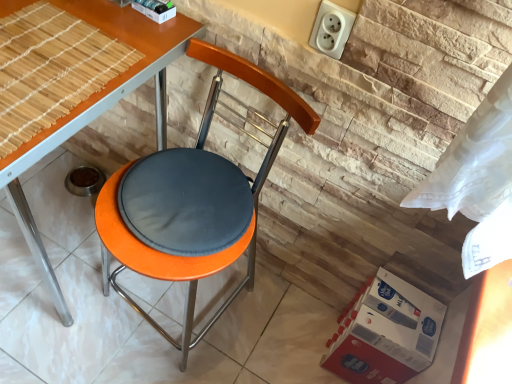
Where is `free point above bamboo mat at upper left (from a real-world perspective)`? The width and height of the screenshot is (512, 384). free point above bamboo mat at upper left (from a real-world perspective) is located at coordinates (47, 58).